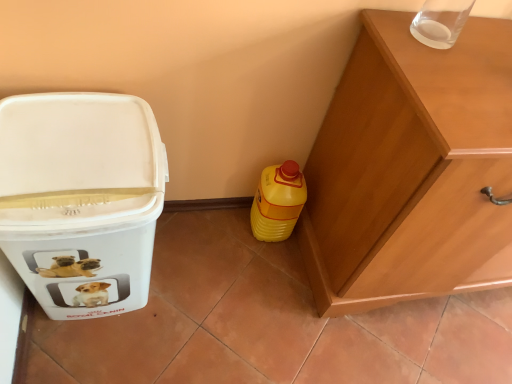
At what (x,y) coordinates should I click in order to perform the action: click on vacant space to the right of white plastic container at left. Please return your answer as a coordinate pair (x, y). The height and width of the screenshot is (384, 512). Looking at the image, I should click on (212, 297).